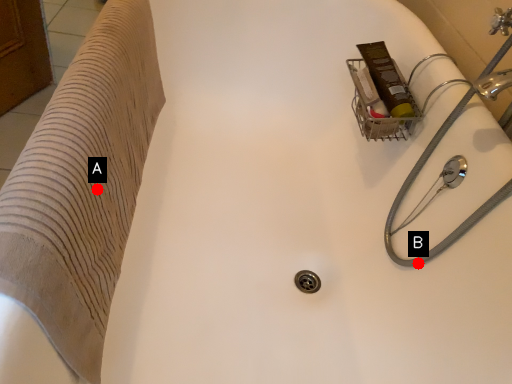
Question: Two points are circled on the image, labeled by A and B beside each circle. Which of the following is the farthest from the observer?

Choices:
 (A) A is further
 (B) B is further

Answer: (B)